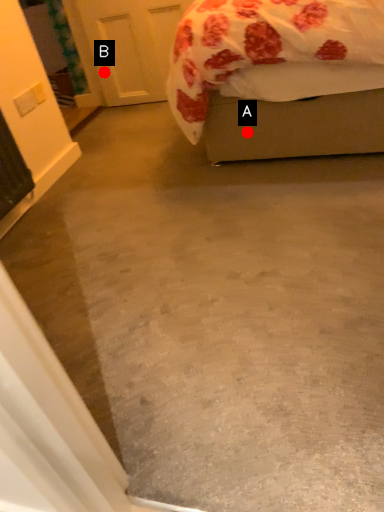
Question: Two points are circled on the image, labeled by A and B beside each circle. Which of the following is the farthest from the observer?

Choices:
 (A) A is further
 (B) B is further

Answer: (B)